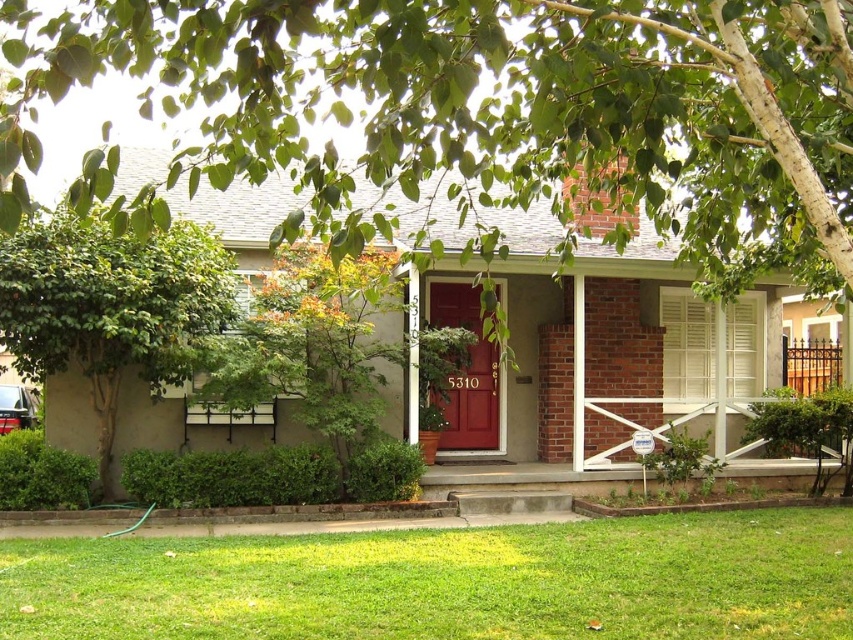
Is green leafy tree at upper center in front of green grass at lower center?

Yes.

Is green leafy tree at upper center positioned at the back of green grass at lower center?

No.

Identify the location of green leafy tree at upper center. (496, 104).

Who is lower down, green leafy tree at upper center or green leafy tree at left?

Positioned lower is green leafy tree at left.

Is green leafy tree at upper center to the right of green leafy tree at left from the viewer's perspective?

Yes, green leafy tree at upper center is to the right of green leafy tree at left.

Is point (714, 164) positioned before point (108, 307)?

Yes, point (714, 164) is closer to viewer.

Image resolution: width=853 pixels, height=640 pixels. Identify the location of green leafy tree at upper center. (496, 104).

Does green leafy tree at upper center have a greater height compared to matte red door at center?

No, green leafy tree at upper center is not taller than matte red door at center.

Does green leafy tree at upper center appear on the left side of matte red door at center?

Indeed, green leafy tree at upper center is positioned on the left side of matte red door at center.

At what (x,y) coordinates should I click in order to perform the action: click on green leafy tree at upper center. Please return your answer as a coordinate pair (x, y). Looking at the image, I should click on (496, 104).